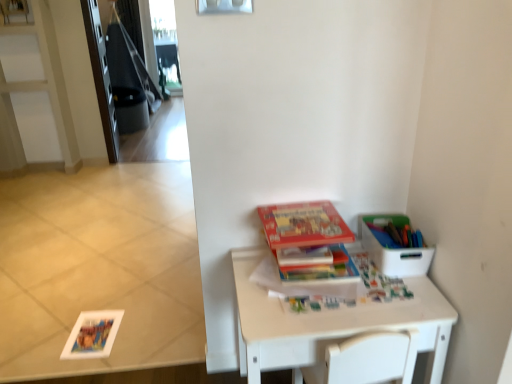
In order to face white matte table at lower right, should I rotate leftwards or rightwards?

Rotate your view right by about 9.717°.

Find the location of a particular element. white plastic container at right is located at coordinates (394, 254).

Where is `matte plastic container at upper right`? matte plastic container at upper right is located at coordinates (395, 233).

Does white matte table at lower right have a greater height compared to white plastic container at right?

Yes, white matte table at lower right is taller than white plastic container at right.

From the image's perspective, between white matte table at lower right and white plastic container at right, who is located below?

white matte table at lower right is shown below in the image.

Is white matte table at lower right directly adjacent to white plastic container at right?

No, white matte table at lower right is not making contact with white plastic container at right.

From the picture: Based on their sizes in the image, would you say white matte table at lower right is bigger or smaller than white plastic container at right?

In the image, white matte table at lower right appears to be larger than white plastic container at right.

How far apart are matte cardboard book at center, the first paperback book in the top-to-bottom sequence, and matte plastic container at upper right?

matte cardboard book at center, the first paperback book in the top-to-bottom sequence, and matte plastic container at upper right are 24.33 centimeters apart from each other.

Between matte cardboard book at center, the first paperback book in the top-to-bottom sequence, and matte plastic container at upper right, which one has less height?

Standing shorter between the two is matte cardboard book at center, the first paperback book in the top-to-bottom sequence.

Relative to matte plastic container at upper right, is matte cardboard book at center, which is counted as the 2th paperback book, starting from the bottom, in front or behind?

In the image, matte cardboard book at center, which is counted as the 2th paperback book, starting from the bottom, appears in front of matte plastic container at upper right.

Consider the image. Is matte cardboard book at center, the first paperback book in the top-to-bottom sequence, to the right of matte plastic container at upper right from the viewer's perspective?

Incorrect, matte cardboard book at center, the first paperback book in the top-to-bottom sequence, is not on the right side of matte plastic container at upper right.

From a real-world perspective, which is physically below, matte plastic container at upper right or white plastic container at right?

white plastic container at right is physically lower.

Would you say white plastic container at right is part of matte plastic container at upper right's contents?

No, matte plastic container at upper right does not contain white plastic container at right.

Which is behind, matte plastic container at upper right or white plastic container at right?

matte plastic container at upper right.

Image resolution: width=512 pixels, height=384 pixels. I want to click on book above the white plastic container at right (from a real-world perspective), so click(x=395, y=233).

Based on their positions, is matte plastic container at upper right located to the left or right of white matte table at lower right?

matte plastic container at upper right is positioned on white matte table at lower right's right side.

From the image's perspective, would you say matte plastic container at upper right is shown under white matte table at lower right?

Actually, matte plastic container at upper right appears above white matte table at lower right in the image.

Is white matte table at lower right located within matte plastic container at upper right?

No, white matte table at lower right is not inside matte plastic container at upper right.

Based on the photo, is matte plastic container at upper right next to white matte table at lower right and touching it?

No, matte plastic container at upper right is not next to white matte table at lower right.

Is hardcover book at center, the 2th paperback book from the top, with matte cardboard book at center, the first paperback book in the top-to-bottom sequence?

No, hardcover book at center, the 2th paperback book from the top, is not next to matte cardboard book at center, the first paperback book in the top-to-bottom sequence.

Considering the positions of point (347, 258) and point (306, 244), is point (347, 258) closer or farther from the camera than point (306, 244)?

Point (347, 258) is farther from the camera than point (306, 244).

From a real-world perspective, which is physically below, hardcover book at center, which is the 1th paperback book in bottom-to-top order, or matte cardboard book at center, which is counted as the 2th paperback book, starting from the bottom?

hardcover book at center, which is the 1th paperback book in bottom-to-top order, is physically lower.

Considering the sizes of objects hardcover book at center, which is the 1th paperback book in bottom-to-top order, and matte cardboard book at center, which is counted as the 2th paperback book, starting from the bottom, in the image provided, who is thinner, hardcover book at center, which is the 1th paperback book in bottom-to-top order, or matte cardboard book at center, which is counted as the 2th paperback book, starting from the bottom,?

hardcover book at center, which is the 1th paperback book in bottom-to-top order.

What's the angular difference between matte plastic container at upper right and matte cardboard book at center, the first paperback book in the top-to-bottom sequence,'s facing directions?

4.05 degrees separate the facing orientations of matte plastic container at upper right and matte cardboard book at center, the first paperback book in the top-to-bottom sequence.

Between matte plastic container at upper right and matte cardboard book at center, which is counted as the 2th paperback book, starting from the bottom, which one has more height?

matte plastic container at upper right.

Which is behind, matte plastic container at upper right or matte cardboard book at center, which is counted as the 2th paperback book, starting from the bottom?

Positioned behind is matte plastic container at upper right.

Looking at this image, visually, is matte plastic container at upper right positioned to the left or to the right of matte cardboard book at center, the first paperback book in the top-to-bottom sequence?

Clearly, matte plastic container at upper right is on the right of matte cardboard book at center, the first paperback book in the top-to-bottom sequence, in the image.

Considering the sizes of objects matte cardboard book at center, the first paperback book in the top-to-bottom sequence, and white plastic container at right in the image provided, who is bigger, matte cardboard book at center, the first paperback book in the top-to-bottom sequence, or white plastic container at right?

white plastic container at right is bigger.

What's the angular difference between matte cardboard book at center, which is counted as the 2th paperback book, starting from the bottom, and white plastic container at right's facing directions?

There is a 4.05-degree angle between the facing directions of matte cardboard book at center, which is counted as the 2th paperback book, starting from the bottom, and white plastic container at right.

From the image's perspective, is matte cardboard book at center, which is counted as the 2th paperback book, starting from the bottom, above or below white plastic container at right?

Based on their image positions, matte cardboard book at center, which is counted as the 2th paperback book, starting from the bottom, is located above white plastic container at right.

Locate an element on the screen. This screenshot has height=384, width=512. paperback book located in front of the white plastic container at right is located at coordinates (303, 225).

Where is `cardboard box on the right of white matte table at lower right`? cardboard box on the right of white matte table at lower right is located at coordinates (394, 254).

Locate an element on the screen. The height and width of the screenshot is (384, 512). paperback book that is the 2nd one when counting forward from the matte plastic container at upper right is located at coordinates tap(303, 225).

Considering their positions, is white plastic container at right positioned further to matte plastic container at upper right than matte cardboard book at center, which is counted as the 2th paperback book, starting from the bottom?

Among the two, matte cardboard book at center, which is counted as the 2th paperback book, starting from the bottom, is located further to matte plastic container at upper right.

Consider the image. When comparing their distances from white matte table at lower right, does white plastic container at right or matte plastic container at upper right seem closer?

The object closer to white matte table at lower right is white plastic container at right.

From the picture: Estimate the real-world distances between objects in this image. Which object is closer to white matte table at lower right, hardcover book at center, which is the 1th paperback book in bottom-to-top order, or matte cardboard book at center, which is counted as the 2th paperback book, starting from the bottom?

hardcover book at center, which is the 1th paperback book in bottom-to-top order, is closer to white matte table at lower right.

Which object lies further to the anchor point white plastic container at right, hardcover book at center, which is the 1th paperback book in bottom-to-top order, or white matte table at lower right?

white matte table at lower right is positioned further to the anchor white plastic container at right.

Estimate the real-world distances between objects in this image. Which object is closer to white plastic container at right, matte plastic container at upper right or hardcover book at center, the 2th paperback book from the top?

matte plastic container at upper right.

From the picture: Estimate the real-world distances between objects in this image. Which object is further from white matte table at lower right, matte cardboard book at center, the first paperback book in the top-to-bottom sequence, or matte plastic container at upper right?

Based on the image, matte plastic container at upper right appears to be further to white matte table at lower right.

Estimate the real-world distances between objects in this image. Which object is closer to hardcover book at center, the 2th paperback book from the top, white matte table at lower right or white plastic container at right?

Based on the image, white plastic container at right appears to be nearer to hardcover book at center, the 2th paperback book from the top.

Which object lies further to the anchor point matte plastic container at upper right, white plastic container at right or hardcover book at center, which is the 1th paperback book in bottom-to-top order?

hardcover book at center, which is the 1th paperback book in bottom-to-top order, lies further to matte plastic container at upper right than the other object.

The height and width of the screenshot is (384, 512). Find the location of `paperback book situated between matte cardboard book at center, the first paperback book in the top-to-bottom sequence, and white plastic container at right from left to right`. paperback book situated between matte cardboard book at center, the first paperback book in the top-to-bottom sequence, and white plastic container at right from left to right is located at coordinates (324, 272).

Find the location of a particular element. This screenshot has width=512, height=384. paperback book situated between matte cardboard book at center, the first paperback book in the top-to-bottom sequence, and matte plastic container at upper right from left to right is located at coordinates (324, 272).

You are a GUI agent. You are given a task and a screenshot of the screen. Output one action in this format:
    pyautogui.click(x=<x>, y=<y>)
    Task: Click on the cardboard box between matte cardboard book at center, which is counted as the 2th paperback book, starting from the bottom, and matte plastic container at upper right
    
    Given the screenshot: What is the action you would take?
    pyautogui.click(x=394, y=254)

Image resolution: width=512 pixels, height=384 pixels. Find the location of `cardboard box between matte cardboard book at center, the first paperback book in the top-to-bottom sequence, and white matte table at lower right, in the vertical direction`. cardboard box between matte cardboard book at center, the first paperback book in the top-to-bottom sequence, and white matte table at lower right, in the vertical direction is located at coordinates (394, 254).